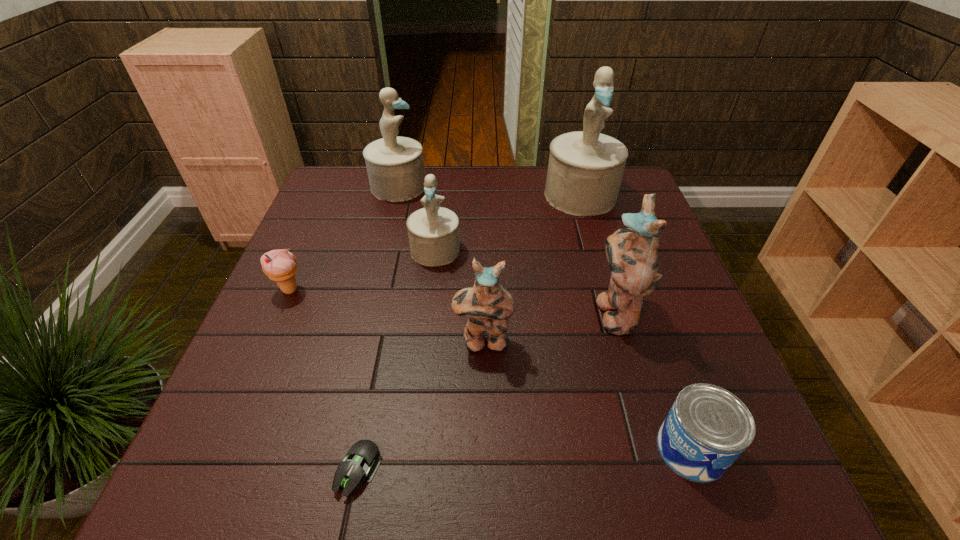
The image size is (960, 540). I want to click on white figurine that is the second closest one to the can, so click(x=585, y=169).

What are the coordinates of `free region that satisfies the following two spatial constraints: 1. at the beak of the gray computer mouse; 2. on the right side of the second biggest white figurine` in the screenshot? It's located at (329, 470).

This screenshot has width=960, height=540. I want to click on vacant region that satisfies the following two spatial constraints: 1. on the front-facing side of the bigger pink figurine; 2. on the front side of the gray computer mouse, so [x=660, y=470].